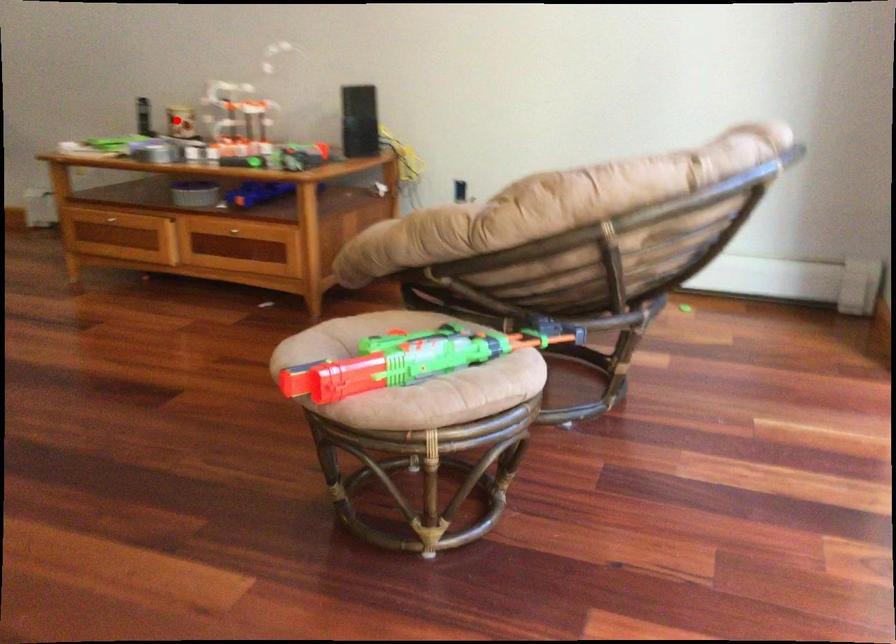
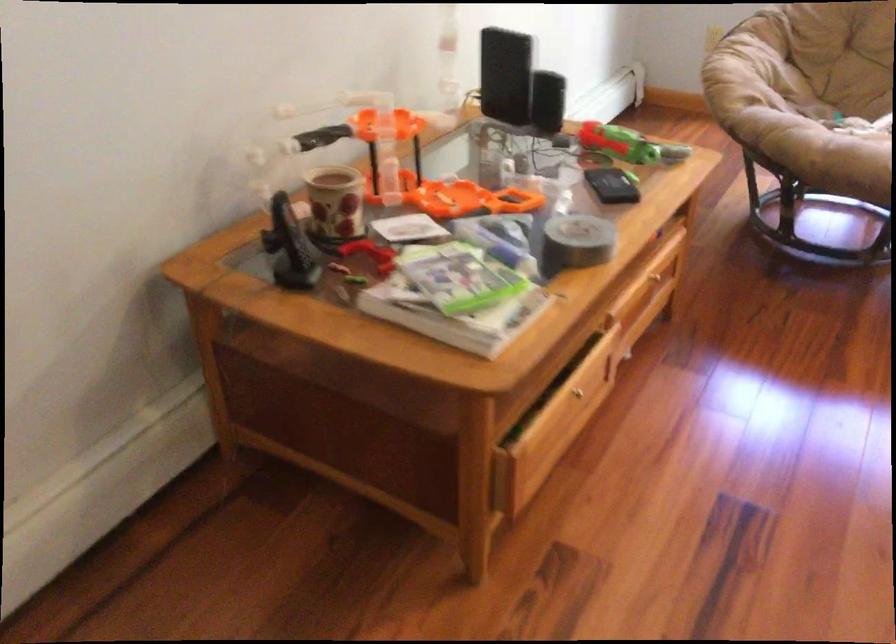
In the second image, find the point that corresponds to the highlighted location in the first image.

(334, 203)